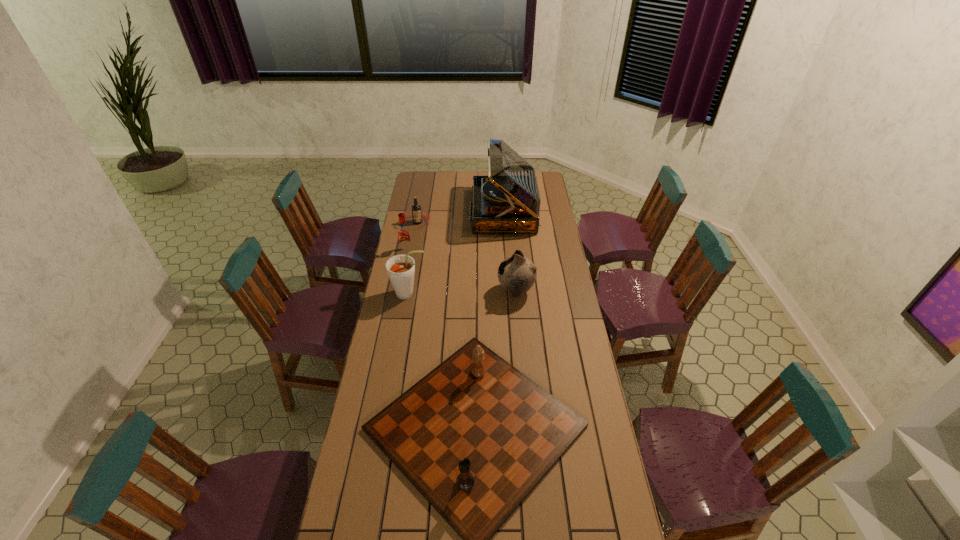
Where is `root beer that stands as the closest to the shortest root beer`? This screenshot has width=960, height=540. root beer that stands as the closest to the shortest root beer is located at coordinates (404, 237).

Where is `free space that satisfies the following two spatial constraints: 1. on the front-facing side of the tallest object; 2. on the label of the shortest root beer`? free space that satisfies the following two spatial constraints: 1. on the front-facing side of the tallest object; 2. on the label of the shortest root beer is located at coordinates (505, 222).